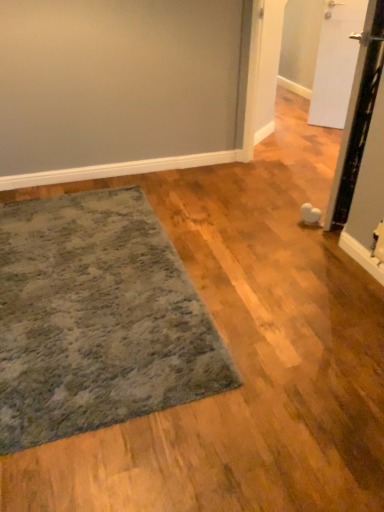
Question: Are white matte door at upper right, placed as the 2th door when sorted from front to back, and white glossy door at right, the second door from the back, located far from each other?

Choices:
 (A) yes
 (B) no

Answer: (A)

Question: Considering the relative positions of white matte door at upper right, placed as the 2th door when sorted from front to back, and white glossy door at right, the second door from the back, in the image provided, is white matte door at upper right, placed as the 2th door when sorted from front to back, to the right of white glossy door at right, the second door from the back, from the viewer's perspective?

Choices:
 (A) yes
 (B) no

Answer: (A)

Question: Can we say white matte door at upper right, acting as the first door starting from the back, lies outside white glossy door at right, acting as the first door starting from the front?

Choices:
 (A) yes
 (B) no

Answer: (A)

Question: Could you tell me if white matte door at upper right, acting as the first door starting from the back, is facing white glossy door at right, the second door from the back?

Choices:
 (A) yes
 (B) no

Answer: (A)

Question: Can you see white matte door at upper right, placed as the 2th door when sorted from front to back, touching white glossy door at right, the second door from the back?

Choices:
 (A) no
 (B) yes

Answer: (A)

Question: Is white glossy door at right, the second door from the back, surrounded by white matte door at upper right, acting as the first door starting from the back?

Choices:
 (A) yes
 (B) no

Answer: (B)

Question: Does textured gray rug at lower left have a lesser width compared to white glossy door at right, acting as the first door starting from the front?

Choices:
 (A) no
 (B) yes

Answer: (A)

Question: Is textured gray rug at lower left at the left side of white glossy door at right, the second door from the back?

Choices:
 (A) yes
 (B) no

Answer: (A)

Question: From a real-world perspective, is textured gray rug at lower left physically above white glossy door at right, acting as the first door starting from the front?

Choices:
 (A) no
 (B) yes

Answer: (A)

Question: Is textured gray rug at lower left touching white glossy door at right, the second door from the back?

Choices:
 (A) yes
 (B) no

Answer: (B)

Question: Is textured gray rug at lower left to the right of white glossy door at right, acting as the first door starting from the front, from the viewer's perspective?

Choices:
 (A) no
 (B) yes

Answer: (A)

Question: Is white glossy door at right, acting as the first door starting from the front, completely or partially inside textured gray rug at lower left?

Choices:
 (A) no
 (B) yes

Answer: (A)

Question: From a real-world perspective, is white matte door at upper right, placed as the 2th door when sorted from front to back, physically below textured gray rug at lower left?

Choices:
 (A) yes
 (B) no

Answer: (B)